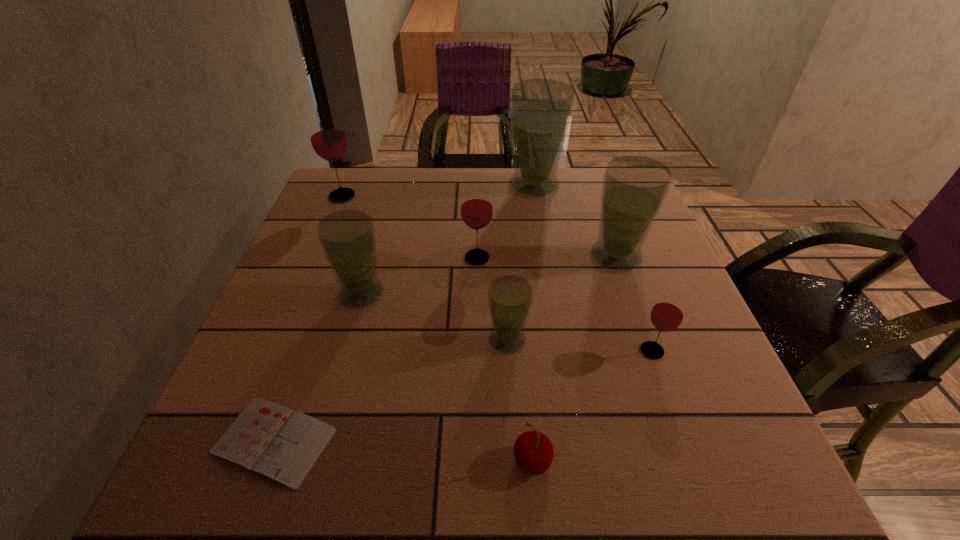
I want to click on vacant space at the far edge, so click(x=460, y=196).

Locate an element on the screen. vacant position at the near edge of the desktop is located at coordinates (594, 455).

In the image, there is a desktop. At what (x,y) coordinates should I click in order to perform the action: click on vacant area at the left edge. Please return your answer as a coordinate pair (x, y). This screenshot has width=960, height=540. Looking at the image, I should click on (326, 364).

Image resolution: width=960 pixels, height=540 pixels. Identify the location of free region at the right edge of the desktop. (627, 307).

The image size is (960, 540). In the image, there is a desktop. In order to click on vacant region at the near right corner in this screenshot , I will do `click(725, 444)`.

You are a GUI agent. You are given a task and a screenshot of the screen. Output one action in this format:
    pyautogui.click(x=<x>, y=<y>)
    Task: Click on the free spot between the second nearest red glass and the shortest object
    The image size is (960, 540).
    Given the screenshot: What is the action you would take?
    pyautogui.click(x=375, y=349)

The image size is (960, 540). What are the coordinates of `free space between the third smallest blue glass and the shortest object` in the screenshot? It's located at (444, 348).

Where is `empty space that is in between the third nearest blue glass and the shortest object`? empty space that is in between the third nearest blue glass and the shortest object is located at coordinates (444, 348).

Image resolution: width=960 pixels, height=540 pixels. Identify the location of blank region between the tallest glass and the shortest object. (404, 313).

At what (x,y) coordinates should I click in order to perform the action: click on empty space that is in between the red cherry and the rightmost blue glass. Please return your answer as a coordinate pair (x, y). Image resolution: width=960 pixels, height=540 pixels. Looking at the image, I should click on (574, 359).